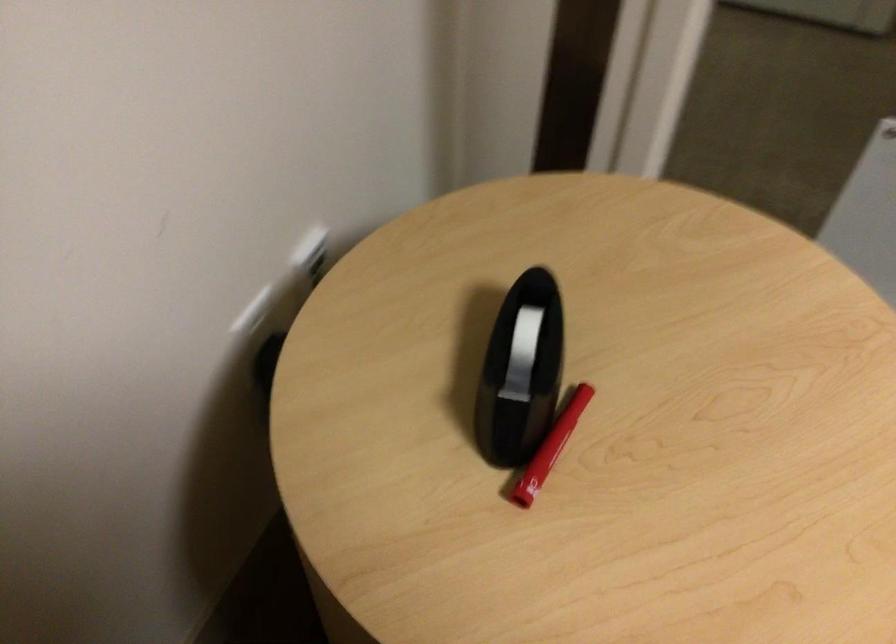
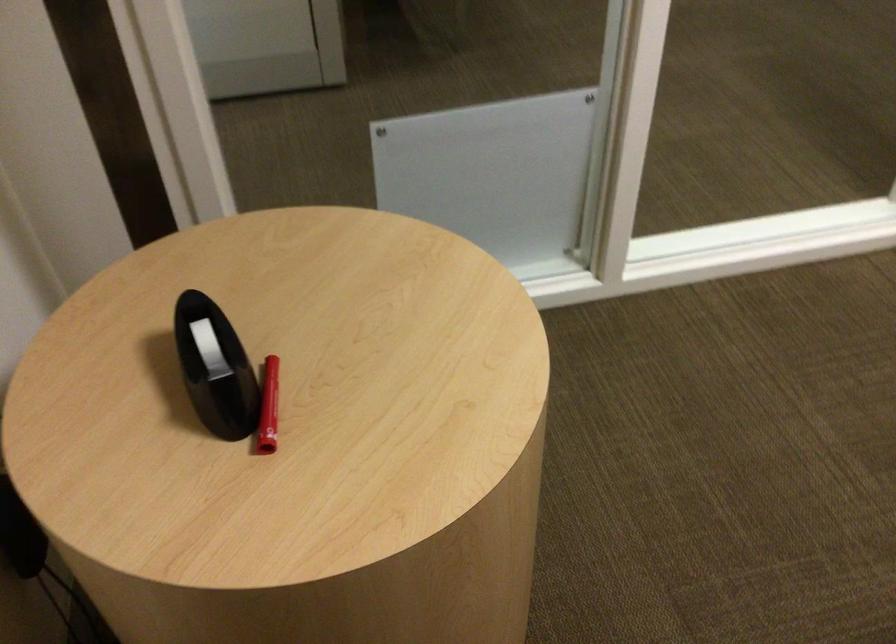
Question: The camera is either moving clockwise (left) or counter-clockwise (right) around the object. The first image is from the beginning of the video and the second image is from the end. Is the camera moving left or right when shooting the video?

Choices:
 (A) Left
 (B) Right

Answer: (A)